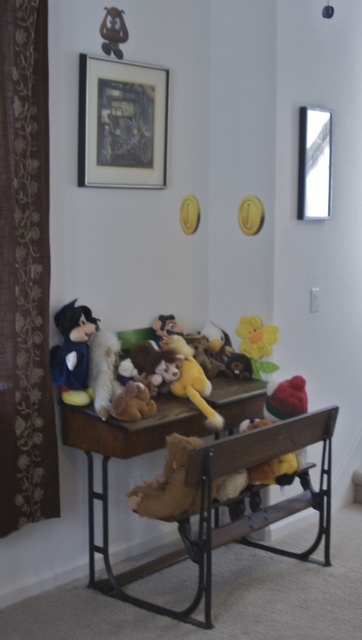
Does brown floral fabric curtain at left have a greater width compared to fluffy yellow stuffed animal at center?

No, brown floral fabric curtain at left is not wider than fluffy yellow stuffed animal at center.

From the picture: Can you confirm if brown floral fabric curtain at left is positioned above fluffy yellow stuffed animal at center?

Yes.

Image resolution: width=362 pixels, height=640 pixels. What do you see at coordinates (24, 272) in the screenshot? I see `brown floral fabric curtain at left` at bounding box center [24, 272].

Where is `brown floral fabric curtain at left`? This screenshot has width=362, height=640. brown floral fabric curtain at left is located at coordinates (24, 272).

Is fluffy yellow stuffed animal at center positioned before yellow fabric flower at center?

Yes, fluffy yellow stuffed animal at center is in front of yellow fabric flower at center.

What are the coordinates of `fluffy yellow stuffed animal at center` in the screenshot? It's located at (191, 380).

Is matte blue plush at left behind fluffy yellow stuffed animal at center?

No.

Which of these two, matte blue plush at left or fluffy yellow stuffed animal at center, stands shorter?

fluffy yellow stuffed animal at center

The width and height of the screenshot is (362, 640). I want to click on matte blue plush at left, so (x=73, y=353).